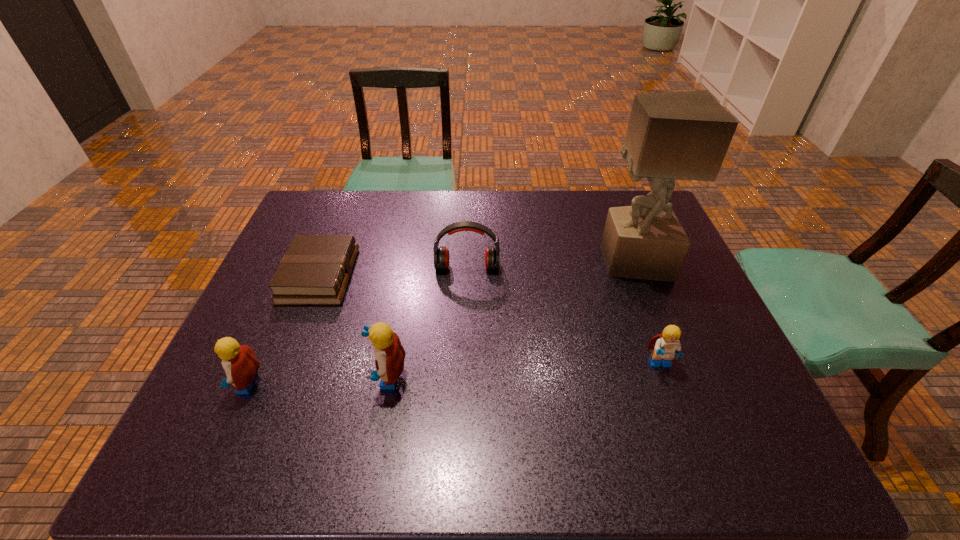
The image size is (960, 540). Find the location of `spot to insert another Lego for uniform distribution`. spot to insert another Lego for uniform distribution is located at coordinates (525, 371).